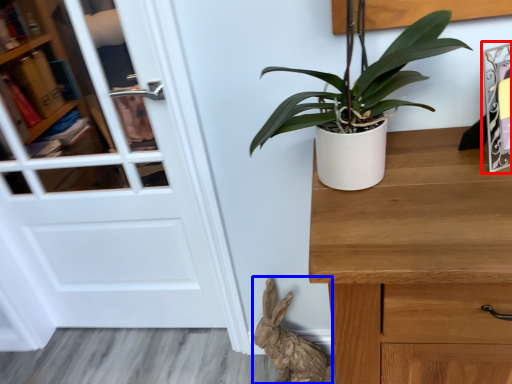
Question: Which object appears closest to the camera in this image, picture frame (highlighted by a red box) or animal (highlighted by a blue box)?

Choices:
 (A) picture frame
 (B) animal

Answer: (A)